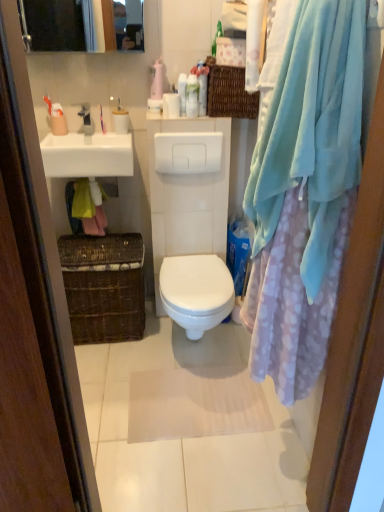
Locate an element on the screen. vacant area that is situated to the right of matte plastic toothbrush at upper left, which appears as the sixth toiletry when viewed from the right is located at coordinates (96, 137).